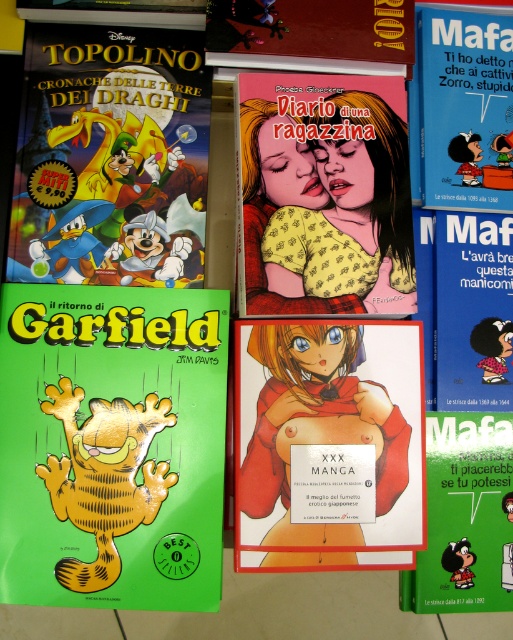
Who is taller, matte green book at upper left or red matte manga at center?

Standing taller between the two is matte green book at upper left.

Which is more to the right, matte green book at upper left or red matte manga at center?

red matte manga at center is more to the right.

Where is `matte green book at upper left`? The image size is (513, 640). matte green book at upper left is located at coordinates pyautogui.click(x=110, y=157).

Is yellow dotted fabric at center wider than matte yellow garfield at center?

Indeed, yellow dotted fabric at center has a greater width compared to matte yellow garfield at center.

Is yellow dotted fabric at center in front of matte yellow garfield at center?

Yes.

Does point (401, 92) lie in front of point (429, 157)?

That is True.

The width and height of the screenshot is (513, 640). I want to click on yellow dotted fabric at center, so click(x=325, y=195).

At what (x,y) coordinates should I click in order to perform the action: click on green glossy garfield at lower left. Please return your answer as a coordinate pair (x, y). Looking at the image, I should click on (111, 445).

In the scene shown: Which is below, green glossy garfield at lower left or matte green book at upper left?

Positioned lower is green glossy garfield at lower left.

Which is in front, point (14, 346) or point (153, 131)?

Point (14, 346)

In order to click on green glossy garfield at lower left in this screenshot , I will do click(111, 445).